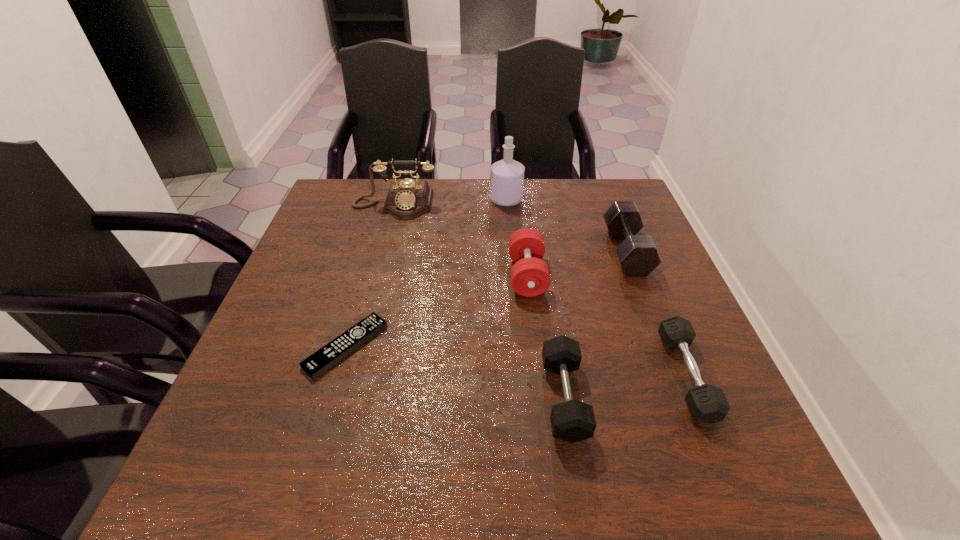
Where is `object that stands as the sixth closest to the second tallest object`? The image size is (960, 540). object that stands as the sixth closest to the second tallest object is located at coordinates (707, 403).

Locate which object is the second closest to the shortest object. Please provide its 2D coordinates. Your answer should be formatted as a tuple, i.e. [(x, y)], where the tuple contains the x and y coordinates of a point satisfying the conditions above.

[(571, 421)]

Locate an element on the screen. dumbbell that is the closest to the shortest dumbbell is located at coordinates (638, 255).

Locate an element on the screen. The width and height of the screenshot is (960, 540). dumbbell that can be found as the closest to the telephone is located at coordinates (530, 277).